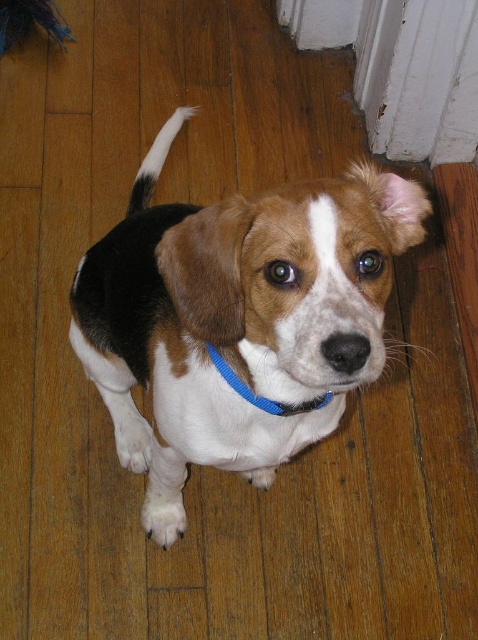
Question: Is brown/white fur dog at center bigger than white fur tail at upper center?

Choices:
 (A) no
 (B) yes

Answer: (B)

Question: Is brown/white fur dog at center wider than white fur tail at upper center?

Choices:
 (A) no
 (B) yes

Answer: (B)

Question: Is the position of brown/white fur dog at center less distant than that of white fur tail at upper center?

Choices:
 (A) no
 (B) yes

Answer: (B)

Question: Which point is farther from the camera taking this photo?

Choices:
 (A) (262, 410)
 (B) (239, 321)
 (C) (152, 168)

Answer: (C)

Question: Estimate the real-world distances between objects in this image. Which object is farther from the white fur tail at upper center?

Choices:
 (A) blue fabric neckband at center
 (B) brown/white fur dog at center

Answer: (A)

Question: Estimate the real-world distances between objects in this image. Which object is closer to the blue fabric neckband at center?

Choices:
 (A) white fur tail at upper center
 (B) brown/white fur dog at center

Answer: (B)